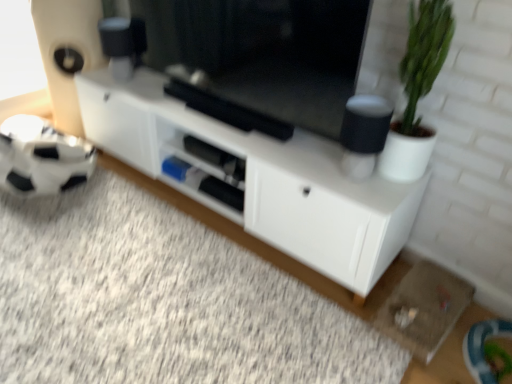
Question: In terms of height, does white matte cabinet at center look taller or shorter compared to green matte plant at right?

Choices:
 (A) short
 (B) tall

Answer: (A)

Question: From a real-world perspective, is white matte cabinet at center physically located above or below green matte plant at right?

Choices:
 (A) below
 (B) above

Answer: (A)

Question: Which is farther from the white matte cabinet at center?

Choices:
 (A) black matte tv at center
 (B) green matte plant at right

Answer: (B)

Question: Which is farther from the green matte plant at right?

Choices:
 (A) black matte tv at center
 (B) white matte cabinet at center

Answer: (B)